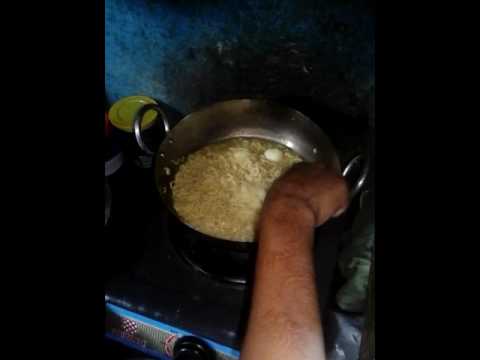
The height and width of the screenshot is (360, 480). In order to click on blue wall in this screenshot , I will do `click(151, 45)`.